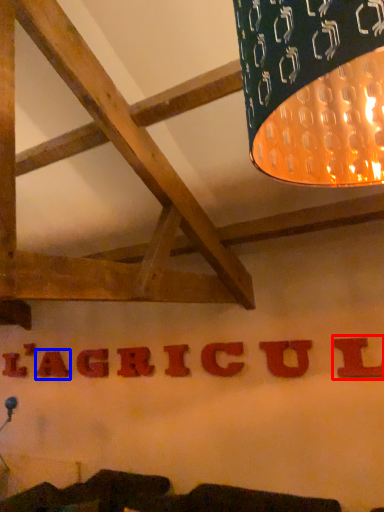
Question: Which point is further to the camera, letter (highlighted by a red box) or letter (highlighted by a blue box)?

Choices:
 (A) letter
 (B) letter

Answer: (B)